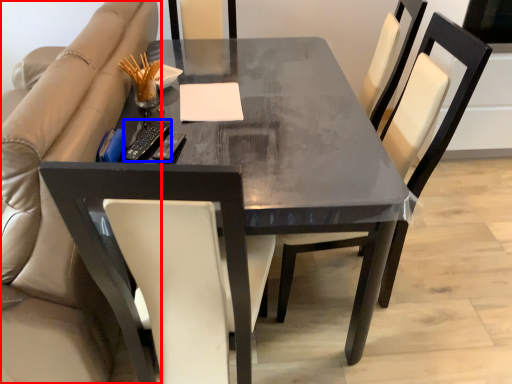
Question: Which object appears farthest to the camera in this image, beige (highlighted by a red box) or remote (highlighted by a blue box)?

Choices:
 (A) beige
 (B) remote

Answer: (B)